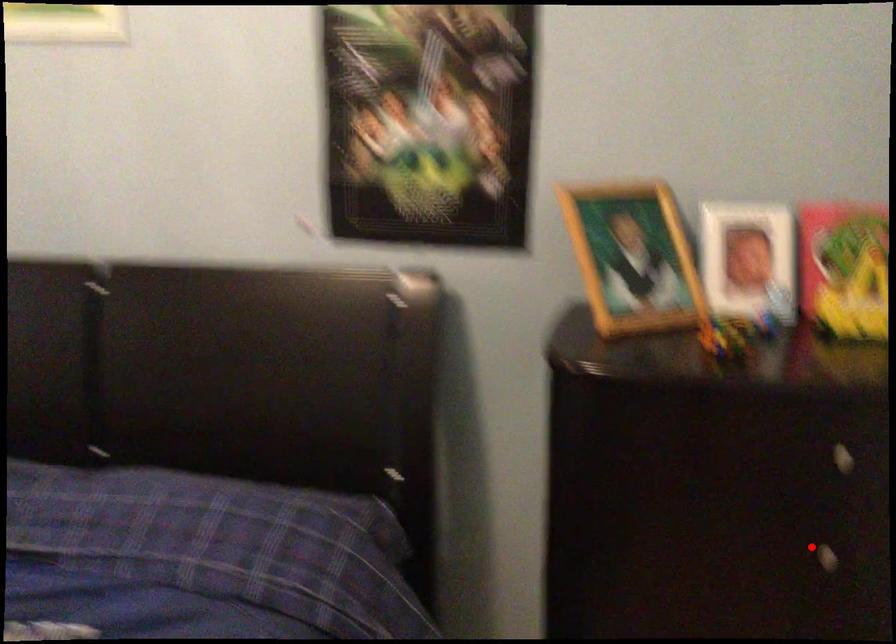
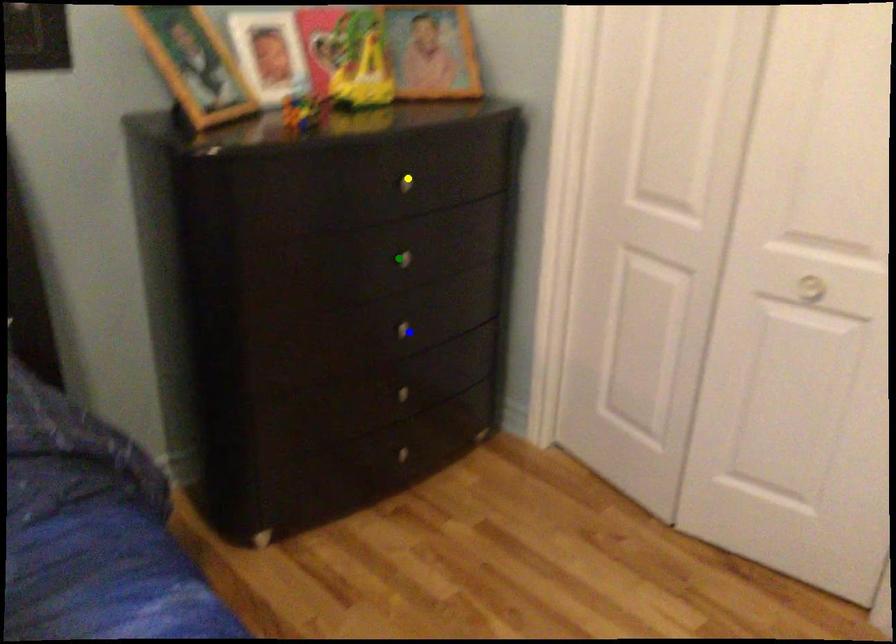
Question: I am providing you with two images of the same scene from different viewpoints. A red point is marked on the first image. You are given multiple points on the second image. Which mark in image 2 goes with the point in image 1?

Choices:
 (A) green point
 (B) yellow point
 (C) blue point

Answer: (A)